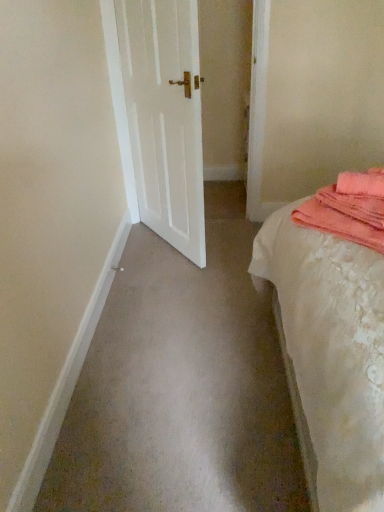
Question: Relative to pink towel at right, is white lace bed at right in front or behind?

Choices:
 (A) behind
 (B) front

Answer: (B)

Question: Considering the positions of white lace bed at right and pink towel at right in the image, is white lace bed at right taller or shorter than pink towel at right?

Choices:
 (A) short
 (B) tall

Answer: (B)

Question: Which object is positioned closest to the white matte door at center?

Choices:
 (A) white lace bed at right
 (B) pink towel at right

Answer: (A)

Question: Estimate the real-world distances between objects in this image. Which object is closer to the white matte door at center?

Choices:
 (A) white lace bed at right
 (B) pink towel at right

Answer: (A)